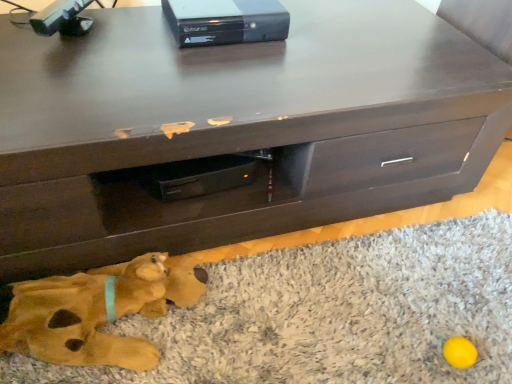
Question: From the image's perspective, is soft plush dog at lower left above soft plush rug at lower center?

Choices:
 (A) no
 (B) yes

Answer: (B)

Question: Is soft plush dog at lower left at the left side of soft plush rug at lower center?

Choices:
 (A) no
 (B) yes

Answer: (B)

Question: Is soft plush rug at lower center completely or partially inside soft plush dog at lower left?

Choices:
 (A) no
 (B) yes

Answer: (A)

Question: Considering the relative positions of soft plush dog at lower left and soft plush rug at lower center in the image provided, is soft plush dog at lower left to the right of soft plush rug at lower center from the viewer's perspective?

Choices:
 (A) yes
 (B) no

Answer: (B)

Question: Does soft plush dog at lower left have a greater height compared to soft plush rug at lower center?

Choices:
 (A) yes
 (B) no

Answer: (A)

Question: Is soft plush dog at lower left positioned far away from soft plush rug at lower center?

Choices:
 (A) yes
 (B) no

Answer: (B)

Question: Can you confirm if black plastic game console at upper center is wider than soft plush dog at lower left?

Choices:
 (A) yes
 (B) no

Answer: (A)

Question: Is black plastic game console at upper center at the left side of soft plush dog at lower left?

Choices:
 (A) no
 (B) yes

Answer: (A)

Question: Is black plastic game console at upper center thinner than soft plush dog at lower left?

Choices:
 (A) yes
 (B) no

Answer: (B)

Question: From the image's perspective, is black plastic game console at upper center above soft plush dog at lower left?

Choices:
 (A) yes
 (B) no

Answer: (A)

Question: Is soft plush dog at lower left inside black plastic game console at upper center?

Choices:
 (A) yes
 (B) no

Answer: (B)

Question: From a real-world perspective, does black plastic game console at upper center stand above soft plush dog at lower left?

Choices:
 (A) yes
 (B) no

Answer: (A)

Question: From a real-world perspective, is soft plush rug at lower center on top of black plastic game console at upper center?

Choices:
 (A) no
 (B) yes

Answer: (A)